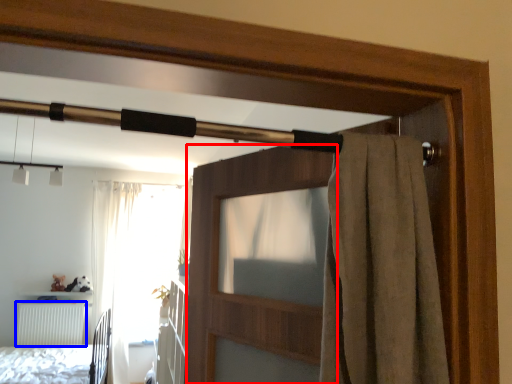
Question: Which object is further to the camera taking this photo, screen door (highlighted by a red box) or radiator (highlighted by a blue box)?

Choices:
 (A) screen door
 (B) radiator

Answer: (B)